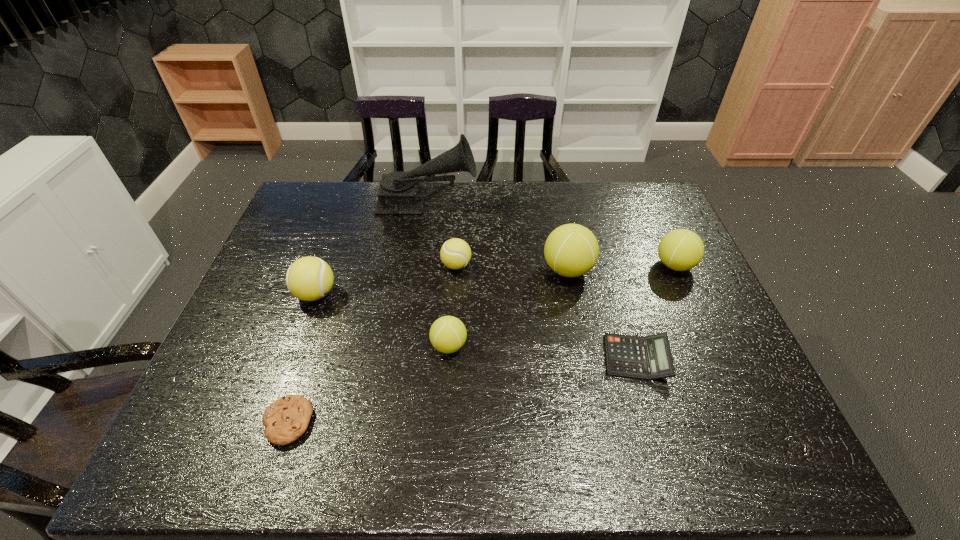
The height and width of the screenshot is (540, 960). What are the coordinates of `free spot located on the front of the smallest green tennis ball` in the screenshot? It's located at (x=442, y=461).

At what (x,y) coordinates should I click in order to perform the action: click on vacant space located on the back of the calculator. Please return your answer as a coordinate pair (x, y). Looking at the image, I should click on tap(625, 320).

Locate an element on the screen. free region located on the right of the cookie is located at coordinates (469, 422).

Where is `object at the far edge`? object at the far edge is located at coordinates [400, 192].

Locate an element on the screen. object situated at the near edge is located at coordinates [x=287, y=418].

Image resolution: width=960 pixels, height=540 pixels. In order to click on object at the left edge in this screenshot , I will do `click(309, 278)`.

The width and height of the screenshot is (960, 540). Identify the location of object present at the right edge. (680, 250).

Locate an element on the screen. vacant space at the far edge is located at coordinates (554, 188).

Identify the location of vacant space at the near edge of the desktop. The width and height of the screenshot is (960, 540). (407, 430).

The width and height of the screenshot is (960, 540). In order to click on vacant region at the left edge of the desktop in this screenshot , I will do `click(215, 425)`.